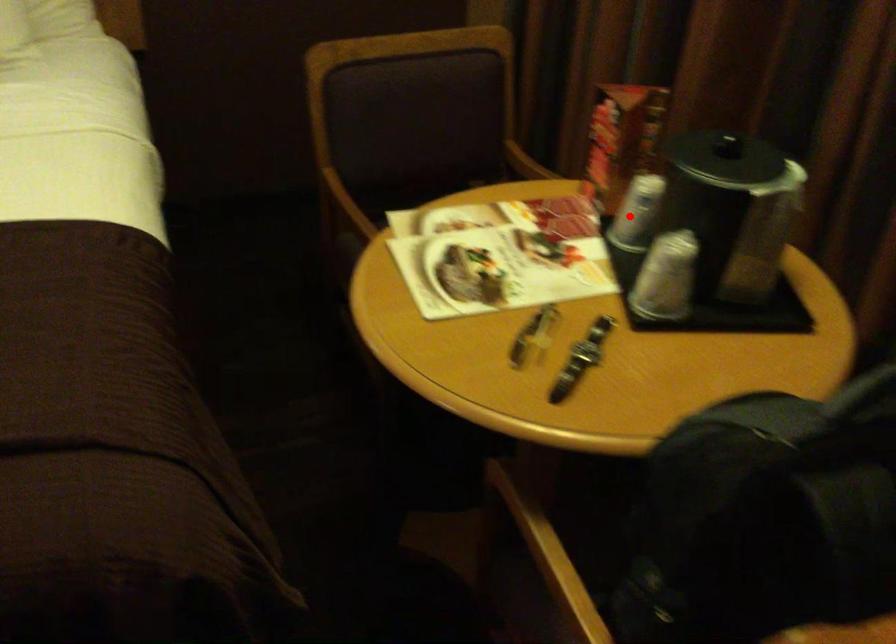
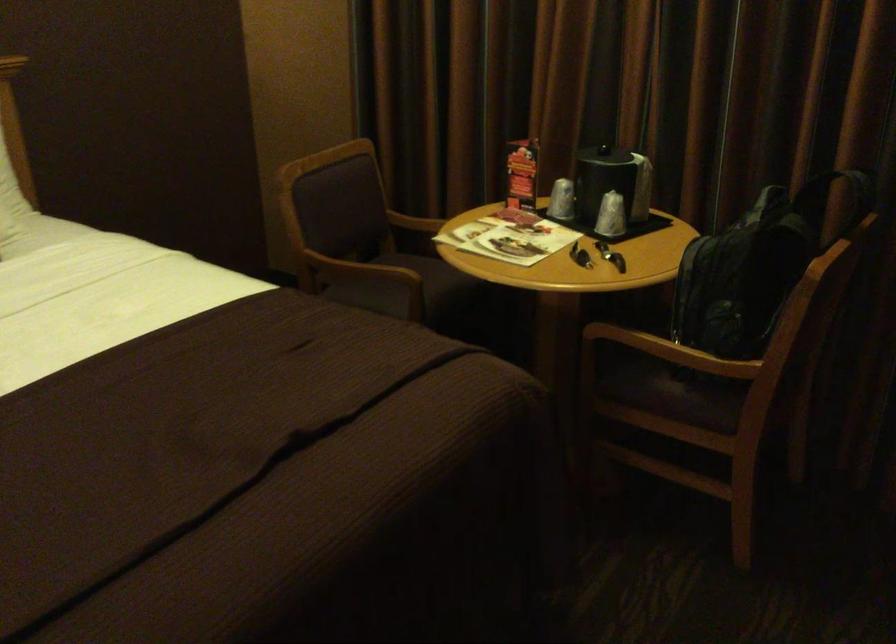
Find the pixel in the second image that matches the highlighted location in the first image.

(561, 200)